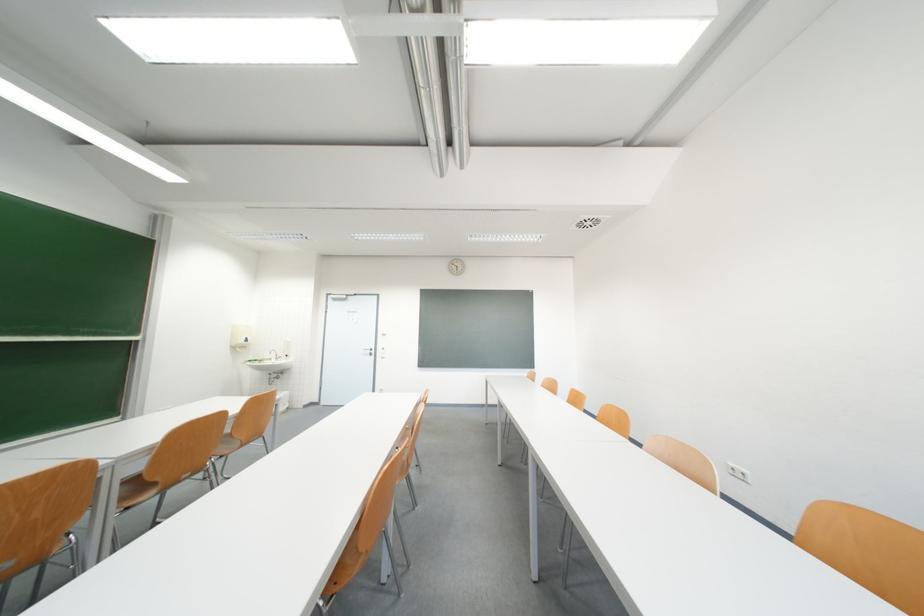
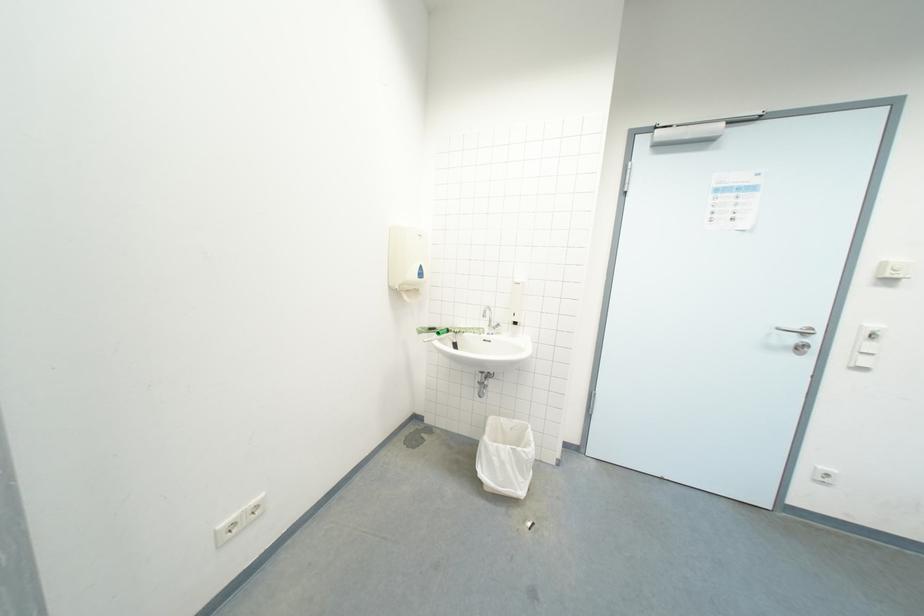
Where in the second image is the point corresponding to (290,355) from the first image?

(511, 318)